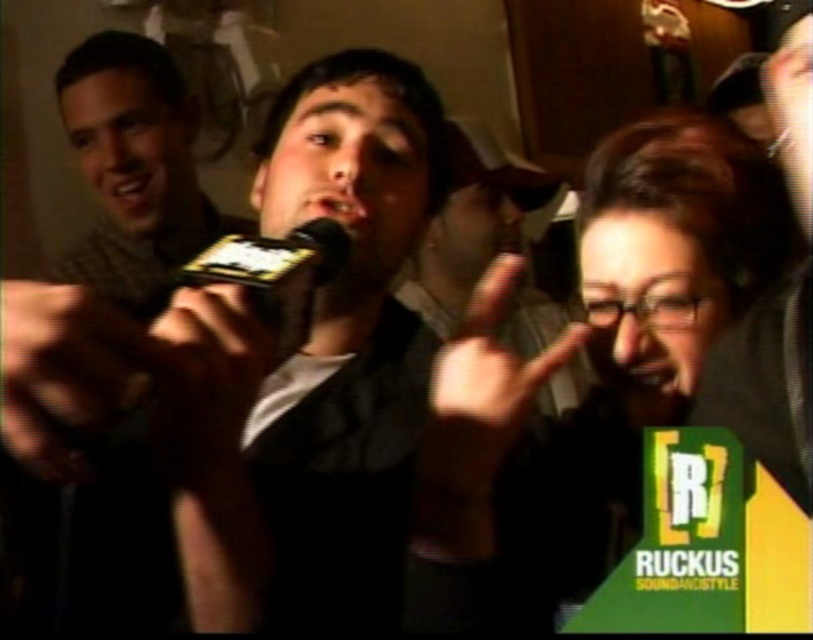
Question: Does matte black microphone at center appear on the right side of matte black finger at center?

Choices:
 (A) yes
 (B) no

Answer: (B)

Question: Does black matte microphone at center have a larger size compared to matte black finger at center?

Choices:
 (A) no
 (B) yes

Answer: (A)

Question: Which is farther from the black matte microphone at center?

Choices:
 (A) matte black microphone at center
 (B) matte black shirt at center
 (C) black plastic microphone at center
 (D) matte black finger at center

Answer: (A)

Question: Estimate the real-world distances between objects in this image. Which object is closer to the matte black microphone at center?

Choices:
 (A) black plastic microphone at center
 (B) black matte hand at lower left

Answer: (A)

Question: Does matte black shirt at center come in front of black matte hand at lower left?

Choices:
 (A) no
 (B) yes

Answer: (A)

Question: Which point is farther to the camera?

Choices:
 (A) (628, 221)
 (B) (66, 468)

Answer: (A)